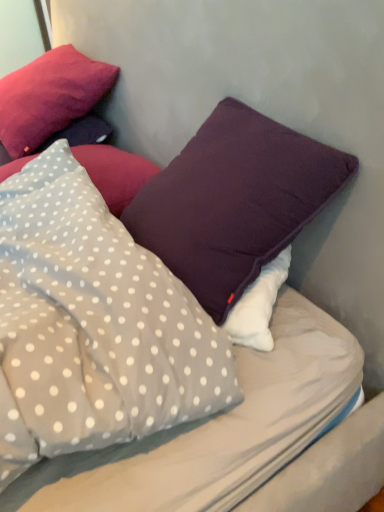
Question: From a real-world perspective, is matte purple pillow at upper left, positioned as the 4th pillow in bottom-to-top order, positioned over purple matte pillow at upper right, arranged as the 3th pillow when viewed from the top, based on gravity?

Choices:
 (A) no
 (B) yes

Answer: (B)

Question: Is there a large distance between matte purple pillow at upper left, arranged as the first pillow when viewed from the top, and purple matte pillow at upper right, arranged as the 3th pillow when viewed from the top?

Choices:
 (A) no
 (B) yes

Answer: (A)

Question: Does matte purple pillow at upper left, arranged as the first pillow when viewed from the top, have a greater height compared to purple matte pillow at upper right, which appears as the second pillow when ordered from the bottom?

Choices:
 (A) yes
 (B) no

Answer: (B)

Question: Is the depth of matte purple pillow at upper left, positioned as the 4th pillow in bottom-to-top order, less than that of purple matte pillow at upper right, which appears as the second pillow when ordered from the bottom?

Choices:
 (A) no
 (B) yes

Answer: (A)

Question: Considering the relative positions of matte purple pillow at upper left, positioned as the 4th pillow in bottom-to-top order, and purple matte pillow at upper right, which appears as the second pillow when ordered from the bottom, in the image provided, is matte purple pillow at upper left, positioned as the 4th pillow in bottom-to-top order, to the left of purple matte pillow at upper right, which appears as the second pillow when ordered from the bottom, from the viewer's perspective?

Choices:
 (A) no
 (B) yes

Answer: (B)

Question: Considering the relative positions of purple matte pillow at upper right, arranged as the 3th pillow when viewed from the top, and gray polka dot pillow at center, the fourth pillow when ordered from top to bottom, in the image provided, is purple matte pillow at upper right, arranged as the 3th pillow when viewed from the top, to the left or to the right of gray polka dot pillow at center, the fourth pillow when ordered from top to bottom,?

Choices:
 (A) left
 (B) right

Answer: (B)

Question: Considering the positions of purple matte pillow at upper right, which appears as the second pillow when ordered from the bottom, and gray polka dot pillow at center, which is counted as the first pillow, starting from the bottom, in the image, is purple matte pillow at upper right, which appears as the second pillow when ordered from the bottom, taller or shorter than gray polka dot pillow at center, which is counted as the first pillow, starting from the bottom,?

Choices:
 (A) tall
 (B) short

Answer: (A)

Question: Considering the positions of point (206, 224) and point (77, 281), is point (206, 224) closer or farther from the camera than point (77, 281)?

Choices:
 (A) closer
 (B) farther

Answer: (B)

Question: Considering the positions of purple matte pillow at upper right, which appears as the second pillow when ordered from the bottom, and gray polka dot pillow at center, which is counted as the first pillow, starting from the bottom, in the image, is purple matte pillow at upper right, which appears as the second pillow when ordered from the bottom, wider or thinner than gray polka dot pillow at center, which is counted as the first pillow, starting from the bottom,?

Choices:
 (A) wide
 (B) thin

Answer: (A)

Question: Considering their positions, is matte purple pillow at upper left, positioned as the 4th pillow in bottom-to-top order, located in front of or behind white dotted fabric pillow at upper left, the second pillow when ordered from top to bottom?

Choices:
 (A) front
 (B) behind

Answer: (B)

Question: Based on their sizes in the image, would you say matte purple pillow at upper left, arranged as the first pillow when viewed from the top, is bigger or smaller than white dotted fabric pillow at upper left, the second pillow when ordered from top to bottom?

Choices:
 (A) small
 (B) big

Answer: (B)

Question: Is point (79, 59) closer or farther from the camera than point (34, 155)?

Choices:
 (A) farther
 (B) closer

Answer: (A)

Question: From the image's perspective, is matte purple pillow at upper left, arranged as the first pillow when viewed from the top, located above or below white dotted fabric pillow at upper left, the third pillow in the bottom-to-top sequence?

Choices:
 (A) above
 (B) below

Answer: (A)

Question: In the image, is gray polka dot pillow at center, which is counted as the first pillow, starting from the bottom, on the left side or the right side of purple matte pillow at upper right, which appears as the second pillow when ordered from the bottom?

Choices:
 (A) left
 (B) right

Answer: (A)

Question: In terms of size, does gray polka dot pillow at center, the fourth pillow when ordered from top to bottom, appear bigger or smaller than purple matte pillow at upper right, arranged as the 3th pillow when viewed from the top?

Choices:
 (A) small
 (B) big

Answer: (A)